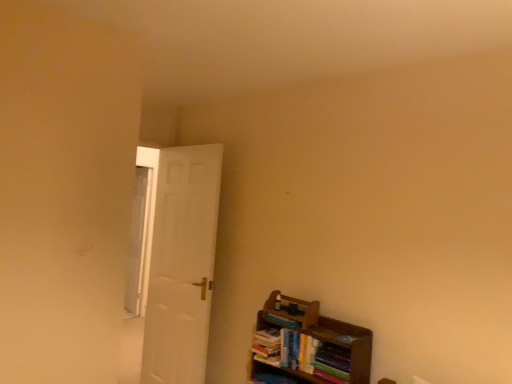
Describe the element at coordinates (309, 344) in the screenshot. This screenshot has width=512, height=384. I see `wooden bookshelf at lower right` at that location.

Find the location of a particular element. white matte door at left is located at coordinates (178, 261).

What do you see at coordinates (178, 261) in the screenshot? I see `white matte door at left` at bounding box center [178, 261].

Measure the distance between point (268, 319) and camera.

They are 8.13 feet apart.

Image resolution: width=512 pixels, height=384 pixels. I want to click on wooden bookshelf at lower right, so click(309, 344).

Which point is more distant from viewer, [176,358] or [279,318]?

Positioned behind is point [176,358].

The image size is (512, 384). In order to click on book that is the 1st one below the white matte door at left (from a real-world perspective) in this screenshot , I will do [282, 320].

Are white matte door at left and hardcover book at lower right, the 1th book positioned from the top, far apart?

Absolutely, white matte door at left is distant from hardcover book at lower right, the 1th book positioned from the top.

Considering the relative sizes of white matte door at left and hardcover book at lower right, acting as the 2th book starting from the bottom, in the image provided, is white matte door at left taller than hardcover book at lower right, acting as the 2th book starting from the bottom,?

Correct, white matte door at left is much taller as hardcover book at lower right, acting as the 2th book starting from the bottom.

Would you say white matte door at left is a long distance from wooden bookshelf at lower right?

Actually, white matte door at left and wooden bookshelf at lower right are a little close together.

How far apart are white matte door at left and wooden bookshelf at lower right?

white matte door at left and wooden bookshelf at lower right are 38.54 inches apart from each other.

From a real-world perspective, is white matte door at left physically above wooden bookshelf at lower right?

Yes.

Is white matte door at left inside or outside of wooden bookshelf at lower right?

white matte door at left cannot be found inside wooden bookshelf at lower right.

Is the position of clear glass window at left more distant than that of hardcover book at lower right, the 1th book positioned from the top?

Yes.

Would you consider clear glass window at left to be distant from hardcover book at lower right, the 1th book positioned from the top?

Yes, clear glass window at left and hardcover book at lower right, the 1th book positioned from the top, are located far from each other.

Where is `book that is the 1st object directly below the clear glass window at left (from a real-world perspective)`? This screenshot has width=512, height=384. book that is the 1st object directly below the clear glass window at left (from a real-world perspective) is located at coordinates (282, 320).

From a real-world perspective, who is located lower, clear glass window at left or hardcover book at lower right, acting as the 2th book starting from the bottom?

hardcover book at lower right, acting as the 2th book starting from the bottom, is physically lower.

Are hardcover book at lower right, acting as the 2th book starting from the bottom, and wooden bookshelf at lower right far apart?

No, there isn't a large distance between hardcover book at lower right, acting as the 2th book starting from the bottom, and wooden bookshelf at lower right.

Looking at this image, is hardcover book at lower right, acting as the 2th book starting from the bottom, positioned before wooden bookshelf at lower right?

No, hardcover book at lower right, acting as the 2th book starting from the bottom, is behind wooden bookshelf at lower right.

What's the angular difference between hardcover book at lower right, acting as the 2th book starting from the bottom, and wooden bookshelf at lower right's facing directions?

The facing directions of hardcover book at lower right, acting as the 2th book starting from the bottom, and wooden bookshelf at lower right are 0.869 degrees apart.

From a real-world perspective, who is located higher, hardcover book at lower right, acting as the 2th book starting from the bottom, or wooden bookshelf at lower right?

hardcover book at lower right, acting as the 2th book starting from the bottom, is physically above.

Can you confirm if clear glass window at left is positioned to the left of hardcover books at lower right, acting as the 2th book starting from the top?

Correct, you'll find clear glass window at left to the left of hardcover books at lower right, acting as the 2th book starting from the top.

Is point (135, 239) positioned behind point (260, 352)?

Yes, point (135, 239) is behind point (260, 352).

How distant is clear glass window at left from hardcover books at lower right, acting as the 2th book starting from the top?

clear glass window at left and hardcover books at lower right, acting as the 2th book starting from the top, are 5.51 feet apart.

Considering the relative sizes of clear glass window at left and hardcover books at lower right, positioned as the 1th book in bottom-to-top order, in the image provided, is clear glass window at left thinner than hardcover books at lower right, positioned as the 1th book in bottom-to-top order,?

Indeed, clear glass window at left has a lesser width compared to hardcover books at lower right, positioned as the 1th book in bottom-to-top order.

Based on the photo, what's the angular difference between hardcover book at lower right, the 1th book positioned from the top, and hardcover books at lower right, positioned as the 1th book in bottom-to-top order,'s facing directions?

hardcover book at lower right, the 1th book positioned from the top, and hardcover books at lower right, positioned as the 1th book in bottom-to-top order, are facing 0.852 degrees away from each other.

Considering the sizes of objects hardcover book at lower right, the 1th book positioned from the top, and hardcover books at lower right, positioned as the 1th book in bottom-to-top order, in the image provided, who is thinner, hardcover book at lower right, the 1th book positioned from the top, or hardcover books at lower right, positioned as the 1th book in bottom-to-top order,?

With smaller width is hardcover book at lower right, the 1th book positioned from the top.

Considering the sizes of objects hardcover book at lower right, acting as the 2th book starting from the bottom, and hardcover books at lower right, positioned as the 1th book in bottom-to-top order, in the image provided, who is bigger, hardcover book at lower right, acting as the 2th book starting from the bottom, or hardcover books at lower right, positioned as the 1th book in bottom-to-top order,?

hardcover books at lower right, positioned as the 1th book in bottom-to-top order.

Is hardcover book at lower right, the 1th book positioned from the top, not close to hardcover books at lower right, acting as the 2th book starting from the top?

hardcover book at lower right, the 1th book positioned from the top, is actually quite close to hardcover books at lower right, acting as the 2th book starting from the top.

Does hardcover book at lower right, the 1th book positioned from the top, have a smaller size compared to white matte door at left?

Indeed, hardcover book at lower right, the 1th book positioned from the top, has a smaller size compared to white matte door at left.

Could you tell me if hardcover book at lower right, acting as the 2th book starting from the bottom, is facing white matte door at left?

No.

Considering the relative sizes of hardcover book at lower right, acting as the 2th book starting from the bottom, and white matte door at left in the image provided, is hardcover book at lower right, acting as the 2th book starting from the bottom, wider than white matte door at left?

Yes, hardcover book at lower right, acting as the 2th book starting from the bottom, is wider than white matte door at left.

Can white matte door at left be found inside hardcover book at lower right, acting as the 2th book starting from the bottom?

No, white matte door at left is not surrounded by hardcover book at lower right, acting as the 2th book starting from the bottom.

Identify the location of door that is above the hardcover book at lower right, acting as the 2th book starting from the bottom (from the image's perspective). (178, 261).

I want to click on shelf lying on the right of white matte door at left, so click(x=309, y=344).

When comparing their distances from clear glass window at left, does hardcover book at lower right, acting as the 2th book starting from the bottom, or hardcover books at lower right, positioned as the 1th book in bottom-to-top order, seem further?

→ The object further to clear glass window at left is hardcover book at lower right, acting as the 2th book starting from the bottom.

Considering their positions, is white matte door at left positioned further to hardcover book at lower right, the 1th book positioned from the top, than wooden bookshelf at lower right?

white matte door at left.

Based on their spatial positions, is white matte door at left or hardcover books at lower right, positioned as the 1th book in bottom-to-top order, further from hardcover book at lower right, acting as the 2th book starting from the bottom?

white matte door at left is further to hardcover book at lower right, acting as the 2th book starting from the bottom.

Based on their spatial positions, is clear glass window at left or white matte door at left further from hardcover books at lower right, acting as the 2th book starting from the top?

clear glass window at left lies further to hardcover books at lower right, acting as the 2th book starting from the top, than the other object.

Estimate the real-world distances between objects in this image. Which object is further from hardcover books at lower right, acting as the 2th book starting from the top, hardcover book at lower right, acting as the 2th book starting from the bottom, or white matte door at left?

white matte door at left is further to hardcover books at lower right, acting as the 2th book starting from the top.

Which object lies nearer to the anchor point hardcover books at lower right, acting as the 2th book starting from the top, wooden bookshelf at lower right or clear glass window at left?

wooden bookshelf at lower right lies closer to hardcover books at lower right, acting as the 2th book starting from the top, than the other object.

Considering their positions, is hardcover book at lower right, the 1th book positioned from the top, positioned further to hardcover books at lower right, positioned as the 1th book in bottom-to-top order, than clear glass window at left?

Among the two, clear glass window at left is located further to hardcover books at lower right, positioned as the 1th book in bottom-to-top order.

Which object lies further to the anchor point hardcover book at lower right, the 1th book positioned from the top, wooden bookshelf at lower right or hardcover books at lower right, positioned as the 1th book in bottom-to-top order?

wooden bookshelf at lower right.

Where is `door between wooden bookshelf at lower right and clear glass window at left in the front-back direction`? door between wooden bookshelf at lower right and clear glass window at left in the front-back direction is located at coordinates (178, 261).

Locate an element on the screen. book positioned between wooden bookshelf at lower right and hardcover book at lower right, acting as the 2th book starting from the bottom, from near to far is located at coordinates (267, 346).

The height and width of the screenshot is (384, 512). In order to click on book between white matte door at left and hardcover book at lower right, acting as the 2th book starting from the bottom, from left to right in this screenshot , I will do `click(267, 346)`.

At what (x,y) coordinates should I click in order to perform the action: click on door positioned between hardcover book at lower right, acting as the 2th book starting from the bottom, and clear glass window at left from near to far. Please return your answer as a coordinate pair (x, y). The height and width of the screenshot is (384, 512). Looking at the image, I should click on (178, 261).